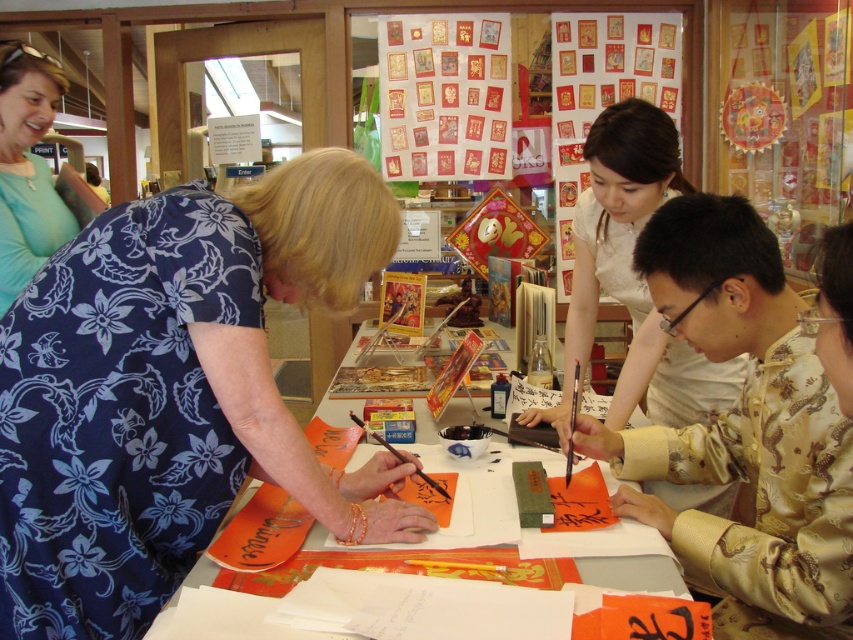
Between gold silk shirt at center and white silk blouse at center, which one has less height?

With less height is gold silk shirt at center.

Who is taller, gold silk shirt at center or white silk blouse at center?

white silk blouse at center is taller.

Between point (763, 390) and point (695, 412), which one is positioned in front?

Positioned in front is point (763, 390).

This screenshot has width=853, height=640. Find the location of `gold silk shirt at center`. gold silk shirt at center is located at coordinates (743, 432).

Which of these two, blue floral dress at center or white paper at center, stands shorter?

With less height is white paper at center.

Describe the element at coordinates (173, 392) in the screenshot. I see `blue floral dress at center` at that location.

Is point (195, 481) in front of point (190, 586)?

No, (195, 481) is behind (190, 586).

Where is `blue floral dress at center`? blue floral dress at center is located at coordinates (x=173, y=392).

Can you confirm if gold silk shirt at center is positioned to the left of matte blue dress at upper left?

No, gold silk shirt at center is not to the left of matte blue dress at upper left.

In the scene shown: Does gold silk shirt at center appear under matte blue dress at upper left?

Indeed, gold silk shirt at center is positioned under matte blue dress at upper left.

What do you see at coordinates (743, 432) in the screenshot? The width and height of the screenshot is (853, 640). I see `gold silk shirt at center` at bounding box center [743, 432].

Locate an element on the screen. gold silk shirt at center is located at coordinates (743, 432).